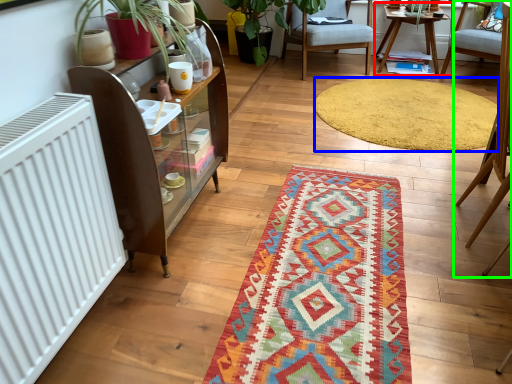
Question: Based on their relative distances, which object is nearer to table (highlighted by a red box)? Choose from mat (highlighted by a blue box) and chair (highlighted by a green box).

Choices:
 (A) mat
 (B) chair

Answer: (A)